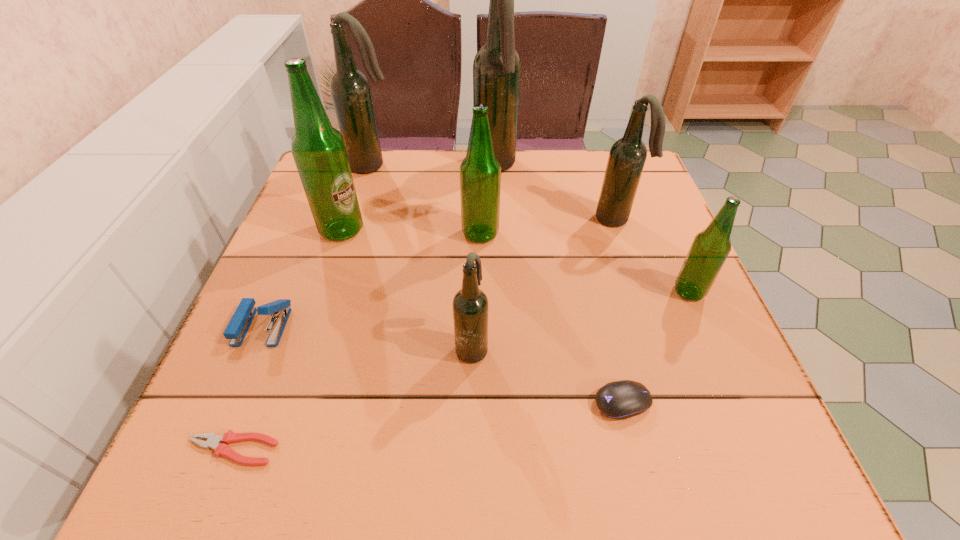
Where is `the nearest dark beer bottle`? the nearest dark beer bottle is located at coordinates [470, 304].

At what (x,y) coordinates should I click in order to perform the action: click on blue stapler. Please return your answer as a coordinate pair (x, y). Looking at the image, I should click on (236, 330).

You are a GUI agent. You are given a task and a screenshot of the screen. Output one action in this format:
    pyautogui.click(x=<x>, y=<y>)
    Task: Click on the third shortest object
    This screenshot has width=960, height=540.
    Given the screenshot: What is the action you would take?
    pyautogui.click(x=236, y=330)

Find the location of a particular element. the ninth farthest object is located at coordinates (623, 399).

Identify the location of computer mouse. The height and width of the screenshot is (540, 960). point(623,399).

Locate an element on the screen. Image resolution: width=960 pixels, height=540 pixels. the shortest object is located at coordinates (213, 441).

Where is `the nearest object`? The height and width of the screenshot is (540, 960). the nearest object is located at coordinates (213, 441).

The width and height of the screenshot is (960, 540). I want to click on vacant region located 0.080m on the left of the tallest object, so click(444, 166).

Where is `blank area located on the right of the second biggest dark beer bottle`? This screenshot has width=960, height=540. blank area located on the right of the second biggest dark beer bottle is located at coordinates (529, 166).

This screenshot has width=960, height=540. Identify the location of vacant point located on the label of the biggest green beer bottle. (451, 230).